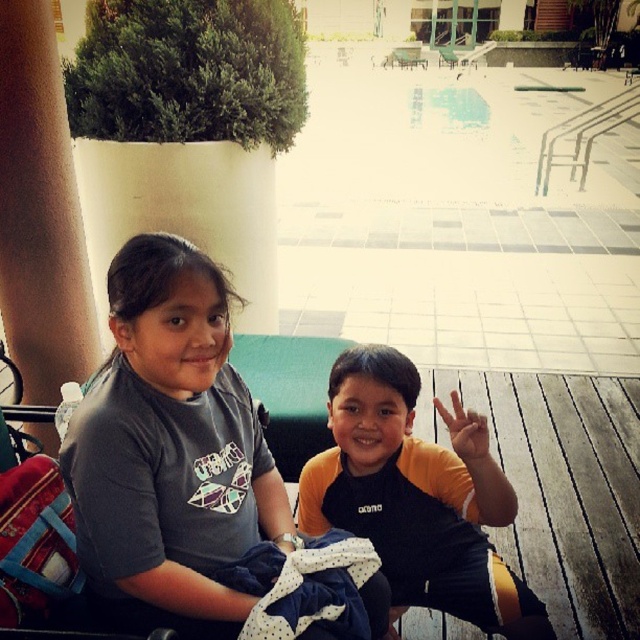
Which of these two, gray cotton shirt at center or yellow-orange swimwear at center, stands shorter?

With less height is yellow-orange swimwear at center.

Describe the element at coordinates (170, 451) in the screenshot. I see `gray cotton shirt at center` at that location.

Between point (180, 385) and point (388, 516), which one is positioned behind?

The point (388, 516) is behind.

Locate an element on the screen. gray cotton shirt at center is located at coordinates (170, 451).

Who is more distant from viewer, [237,426] or [408,65]?

The point [408,65] is behind.

The height and width of the screenshot is (640, 640). What do you see at coordinates (170, 451) in the screenshot? I see `gray cotton shirt at center` at bounding box center [170, 451].

The image size is (640, 640). I want to click on gray cotton shirt at center, so click(x=170, y=451).

Between yellow-orange swimwear at center and wooden bench at center, which one appears on the left side from the viewer's perspective?

From the viewer's perspective, yellow-orange swimwear at center appears more on the left side.

Consider the image. Can you confirm if yellow-orange swimwear at center is smaller than wooden bench at center?

Indeed, yellow-orange swimwear at center has a smaller size compared to wooden bench at center.

Does point (451, 504) come closer to viewer compared to point (403, 65)?

Yes.

Find the location of `yellow-orange swimwear at center`. yellow-orange swimwear at center is located at coordinates (417, 497).